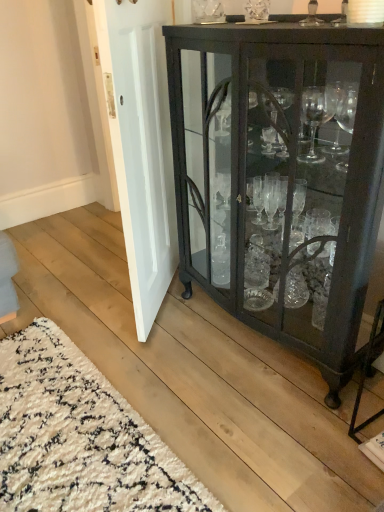
Locate an element on the screen. The height and width of the screenshot is (512, 384). matte black cabinet at right is located at coordinates (281, 178).

Where is `white painted wood door at center`? Image resolution: width=384 pixels, height=512 pixels. white painted wood door at center is located at coordinates (141, 145).

Identify the location of cupboard beneath the white painted wood door at center (from a real-world perspective). (281, 178).

In the scene shown: Is white painted wood door at center in front of matte black cabinet at right?

No, it is behind matte black cabinet at right.

Are white painted wood door at center and matte black cabinet at right making contact?

No.

Is white painted wood door at center facing away from matte black cabinet at right?

Yes, white painted wood door at center is facing away from matte black cabinet at right.

From the image's perspective, between white shaggy rug at lower left and matte black cabinet at right, who is located below?

white shaggy rug at lower left appears lower in the image.

From the picture: Which of these two, white shaggy rug at lower left or matte black cabinet at right, is thinner?

With smaller width is matte black cabinet at right.

Where is `doormat lying on the left of matte black cabinet at right`? doormat lying on the left of matte black cabinet at right is located at coordinates (80, 437).

Does white shaggy rug at lower left have a lesser height compared to matte black cabinet at right?

Yes, white shaggy rug at lower left is shorter than matte black cabinet at right.

From a real-world perspective, is white painted wood door at center physically located above or below white shaggy rug at lower left?

In terms of real-world spatial position, white painted wood door at center is above white shaggy rug at lower left.

Considering the relative positions of white painted wood door at center and white shaggy rug at lower left in the image provided, is white painted wood door at center in front of white shaggy rug at lower left?

No.

Is white shaggy rug at lower left inside or outside of white painted wood door at center?

white shaggy rug at lower left is located beyond the bounds of white painted wood door at center.

Which object is positioned more to the right, white shaggy rug at lower left or white painted wood door at center?

white painted wood door at center.

Is point (115, 498) in front of point (139, 139)?

Yes, point (115, 498) is in front of point (139, 139).

Is white shaggy rug at lower left smaller than white painted wood door at center?

Yes.

Is matte black cabinet at right shorter than white shaggy rug at lower left?

No, matte black cabinet at right is not shorter than white shaggy rug at lower left.

Does matte black cabinet at right have a smaller size compared to white shaggy rug at lower left?

No.

Can you confirm if matte black cabinet at right is positioned to the left of white shaggy rug at lower left?

In fact, matte black cabinet at right is to the right of white shaggy rug at lower left.

This screenshot has height=512, width=384. In the image, there is a white shaggy rug at lower left. Identify the location of cupboard above it (from the image's perspective). (281, 178).

From a real-world perspective, does matte black cabinet at right stand above white painted wood door at center?

No, from a real-world perspective, matte black cabinet at right is not over white painted wood door at center

Is the surface of matte black cabinet at right in direct contact with white painted wood door at center?

matte black cabinet at right and white painted wood door at center are not in contact.

Is point (360, 216) closer to camera compared to point (155, 82)?

Yes.

Where is `cupboard below the white painted wood door at center (from a real-world perspective)`? The image size is (384, 512). cupboard below the white painted wood door at center (from a real-world perspective) is located at coordinates (281, 178).

The height and width of the screenshot is (512, 384). I want to click on cupboard that appears above the white shaggy rug at lower left (from the image's perspective), so click(x=281, y=178).

Based on their spatial positions, is matte black cabinet at right or white painted wood door at center closer to white shaggy rug at lower left?

The object closer to white shaggy rug at lower left is white painted wood door at center.

When comparing their distances from white shaggy rug at lower left, does white painted wood door at center or matte black cabinet at right seem closer?

white painted wood door at center is closer to white shaggy rug at lower left.

Which object lies further to the anchor point white painted wood door at center, white shaggy rug at lower left or matte black cabinet at right?

white shaggy rug at lower left.

Considering their positions, is matte black cabinet at right positioned closer to white painted wood door at center than white shaggy rug at lower left?

matte black cabinet at right.

From the image, which object appears to be nearer to matte black cabinet at right, white shaggy rug at lower left or white painted wood door at center?

white painted wood door at center is positioned closer to the anchor matte black cabinet at right.

When comparing their distances from matte black cabinet at right, does white painted wood door at center or white shaggy rug at lower left seem closer?

white painted wood door at center is closer to matte black cabinet at right.

At what (x,y) coordinates should I click in order to perform the action: click on cupboard between white painted wood door at center and white shaggy rug at lower left in the up-down direction. Please return your answer as a coordinate pair (x, y). This screenshot has height=512, width=384. Looking at the image, I should click on (281, 178).